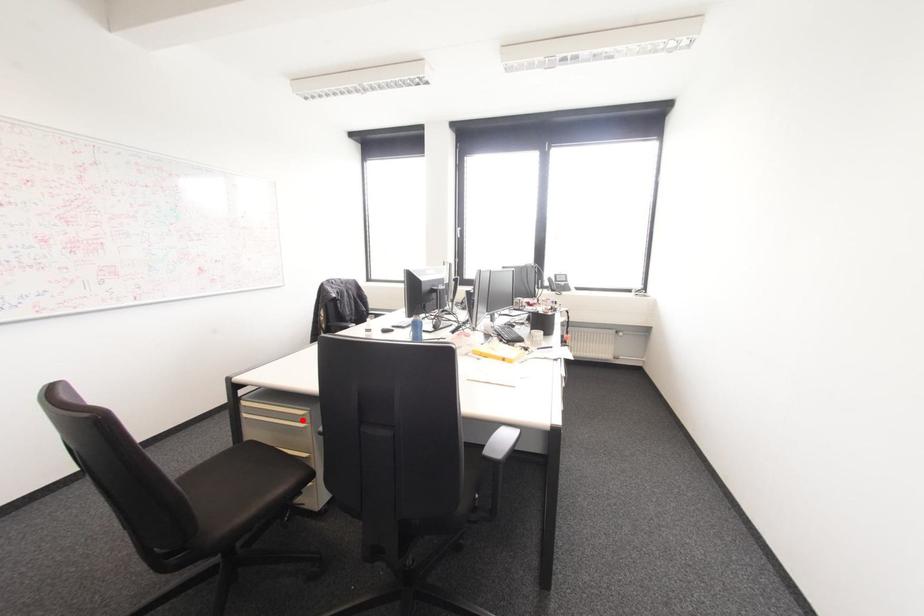
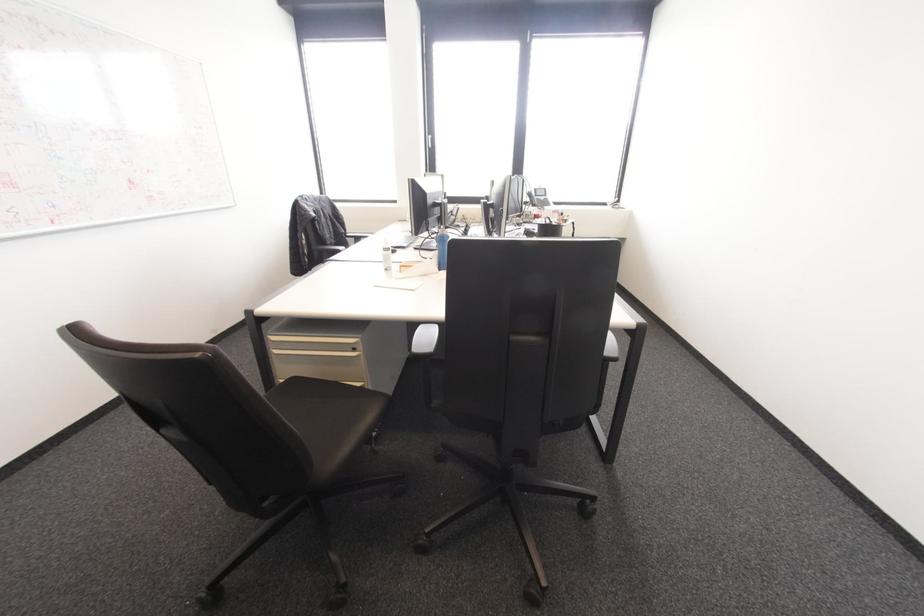
Locate, in the second image, the point that corresponds to the highlighted location in the first image.

(354, 349)